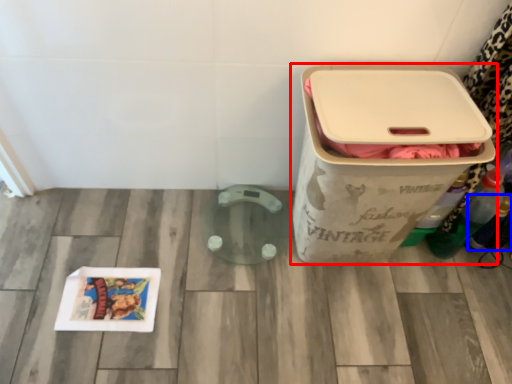
Question: Among these objects, which one is nearest to the camera, waste container (highlighted by a red box) or bottle (highlighted by a blue box)?

Choices:
 (A) waste container
 (B) bottle

Answer: (A)